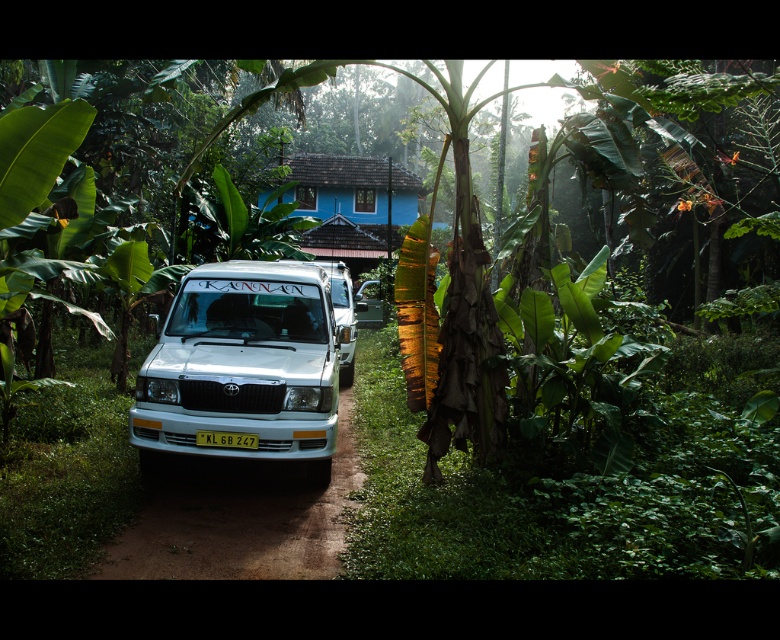
You are a traveler who needs to take a photo of the blue painted wooden hut at center and the yellow plastic license plate at center. Which object should you focus on first if you want to capture both in a single frame without moving the camera?

The blue painted wooden hut at center is taller than the yellow plastic license plate at center, so you should focus on the blue painted wooden hut at center first to ensure it fits within the frame.

You are a photographer standing in front of the white matte van at center and the yellow plastic license plate at center. Which object would appear larger in your photo if you focus on the van?

The white matte van at center would appear larger in the photo because it is closer to the viewer than the yellow plastic license plate at center.

You are standing at the point marked by the coordinate point at center. The white matte van at center is located at point (243, 365). Can you confirm if the van is exactly at the center of the image?

The white matte van at center is located at point (243, 365), which is the exact center of the image.